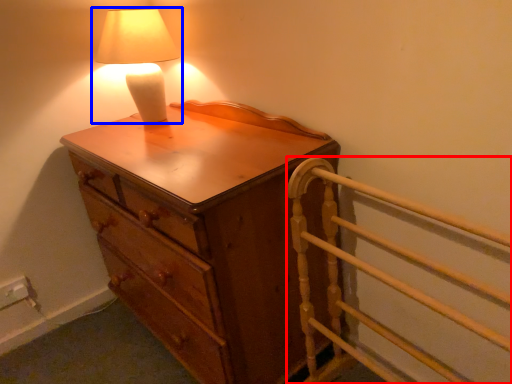
Question: Which object appears closest to the camera in this image, bed frame (highlighted by a red box) or lamp (highlighted by a blue box)?

Choices:
 (A) bed frame
 (B) lamp

Answer: (A)